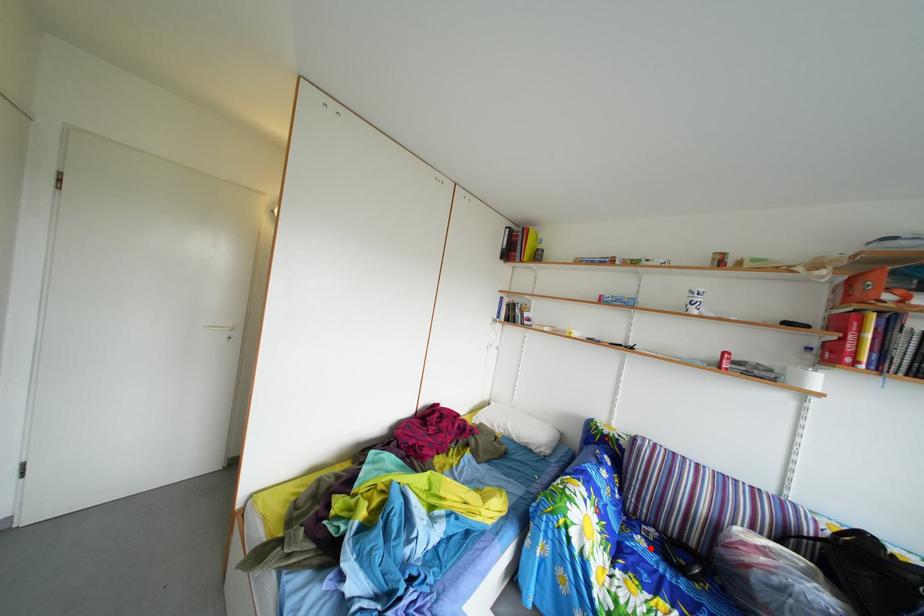
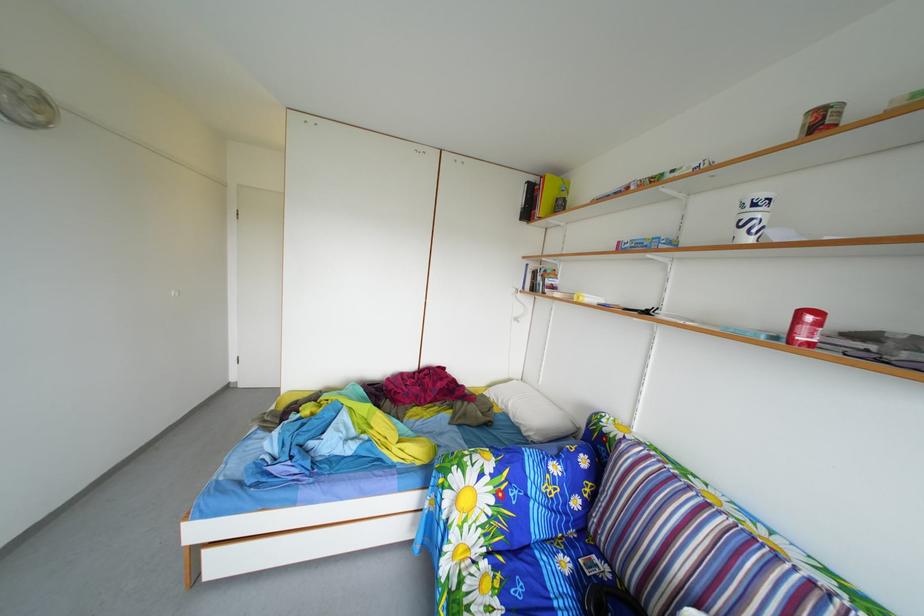
In the second image, find the point that corresponds to the highlighted location in the first image.

(576, 570)